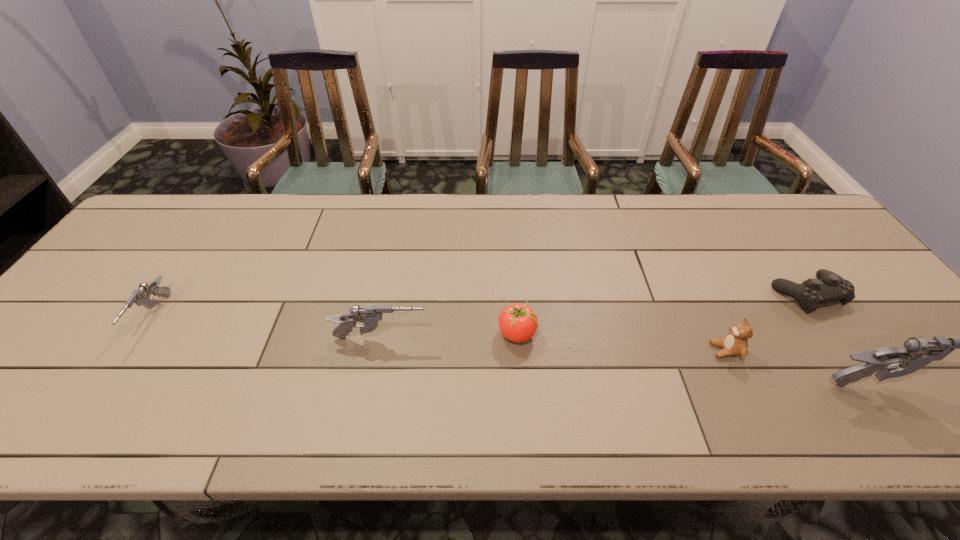
At what (x,y) coordinates should I click in order to perform the action: click on the leftmost gun. Please return your answer as a coordinate pair (x, y). This screenshot has height=540, width=960. Looking at the image, I should click on (141, 296).

Locate an element on the screen. This screenshot has width=960, height=540. the leftmost object is located at coordinates (141, 296).

Identify the location of the second shortest gun. This screenshot has height=540, width=960. [370, 315].

Locate an element on the screen. Image resolution: width=960 pixels, height=540 pixels. the fifth object from right to left is located at coordinates (370, 315).

The width and height of the screenshot is (960, 540). I want to click on control, so click(x=828, y=287).

At what (x,y) coordinates should I click in order to perform the action: click on tomato. Please return your answer as a coordinate pair (x, y). Looking at the image, I should click on (518, 322).

Find the location of a particular element. Image resolution: width=960 pixels, height=540 pixels. teddy bear is located at coordinates (735, 343).

Image resolution: width=960 pixels, height=540 pixels. Identify the location of free spot located 0.120m at the barrel of the leftmost object. (103, 394).

This screenshot has width=960, height=540. Find the location of `blank area located at the barrel of the second gun from right to left`. blank area located at the barrel of the second gun from right to left is located at coordinates (499, 339).

You are a GUI agent. You are given a task and a screenshot of the screen. Output one action in this format:
    pyautogui.click(x=<x>, y=<y>)
    Task: Click on the free location located on the front of the shortest object
    This screenshot has height=540, width=960.
    Given the screenshot: What is the action you would take?
    pyautogui.click(x=851, y=356)